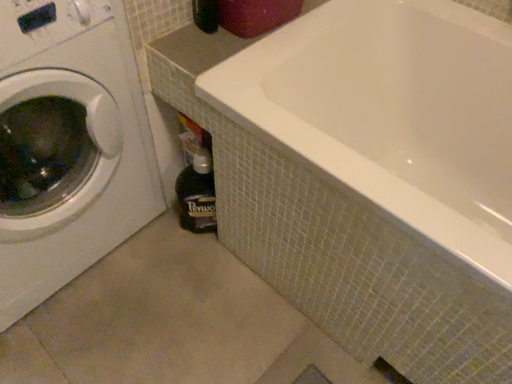
Find the location of a particular element. This screenshot has height=384, width=512. dark brown glass bottle at lower center is located at coordinates (197, 194).

Describe the element at coordinates (392, 114) in the screenshot. I see `white glossy bathtub at center` at that location.

Locate an element on the screen. Image resolution: width=512 pixels, height=384 pixels. dark brown glass bottle at lower center is located at coordinates (197, 194).

From the picture: From their relative heights in the image, would you say white glossy washing machine at left is taller or shorter than white glossy bathtub at center?

Clearly, white glossy washing machine at left is taller compared to white glossy bathtub at center.

Does white glossy washing machine at left have a larger size compared to white glossy bathtub at center?

No.

Is white glossy washing machine at left looking in the opposite direction of white glossy bathtub at center?

white glossy washing machine at left does not have its back to white glossy bathtub at center.

From the image's perspective, is white glossy washing machine at left located above white glossy bathtub at center?

Yes, from the image's perspective, white glossy washing machine at left is above white glossy bathtub at center.

From the image's perspective, does dark brown glass bottle at lower center appear lower than white glossy bathtub at center?

Yes.

Which is behind, dark brown glass bottle at lower center or white glossy bathtub at center?

dark brown glass bottle at lower center is further from the camera.

Looking at this image, which of these two, dark brown glass bottle at lower center or white glossy bathtub at center, is wider?

white glossy bathtub at center is wider.

Considering the relative sizes of white glossy bathtub at center and dark brown glass bottle at lower center in the image provided, is white glossy bathtub at center shorter than dark brown glass bottle at lower center?

No, white glossy bathtub at center is not shorter than dark brown glass bottle at lower center.

From the image's perspective, between white glossy bathtub at center and dark brown glass bottle at lower center, who is located below?

From the image's view, dark brown glass bottle at lower center is below.

From a real-world perspective, which object stands above the other?

From a 3D spatial view, white glossy bathtub at center is above.

Is white glossy bathtub at center inside or outside of dark brown glass bottle at lower center?

white glossy bathtub at center is outside dark brown glass bottle at lower center.

From a real-world perspective, which is physically above, white glossy washing machine at left or dark brown glass bottle at lower center?

white glossy washing machine at left, from a real-world perspective.

Could you tell me if white glossy washing machine at left is facing dark brown glass bottle at lower center?

No, white glossy washing machine at left is not facing towards dark brown glass bottle at lower center.

Considering their positions, is white glossy washing machine at left located in front of or behind dark brown glass bottle at lower center?

white glossy washing machine at left is positioned closer to the viewer than dark brown glass bottle at lower center.

Does white glossy washing machine at left have a lesser width compared to dark brown glass bottle at lower center?

In fact, white glossy washing machine at left might be wider than dark brown glass bottle at lower center.

Can you confirm if white glossy bathtub at center is bigger than white glossy washing machine at left?

Correct, white glossy bathtub at center is larger in size than white glossy washing machine at left.

Is white glossy bathtub at center located outside white glossy washing machine at left?

Yes.

From the image's perspective, does white glossy bathtub at center appear lower than white glossy washing machine at left?

Indeed, from the image's perspective, white glossy bathtub at center is shown beneath white glossy washing machine at left.

How much distance is there between white glossy bathtub at center and white glossy washing machine at left?

21.68 inches.

From a real-world perspective, is dark brown glass bottle at lower center on white glossy washing machine at left?

No, from a real-world perspective, dark brown glass bottle at lower center is not above white glossy washing machine at left.

Does dark brown glass bottle at lower center contain white glossy washing machine at left?

Definitely not — white glossy washing machine at left is not inside dark brown glass bottle at lower center.

How different are the orientations of dark brown glass bottle at lower center and white glossy washing machine at left in degrees?

The angular difference between dark brown glass bottle at lower center and white glossy washing machine at left is 40.1 degrees.

This screenshot has width=512, height=384. Find the location of `bottle below the white glossy washing machine at left (from the image's perspective)`. bottle below the white glossy washing machine at left (from the image's perspective) is located at coordinates (197, 194).

Image resolution: width=512 pixels, height=384 pixels. I want to click on washing machine above the white glossy bathtub at center (from a real-world perspective), so click(68, 145).

In order to click on bathtub that appears above the dark brown glass bottle at lower center (from the image's perspective) in this screenshot , I will do `click(392, 114)`.

Estimate the real-world distances between objects in this image. Which object is closer to white glossy bathtub at center, dark brown glass bottle at lower center or white glossy washing machine at left?

dark brown glass bottle at lower center lies closer to white glossy bathtub at center than the other object.

Which object lies further to the anchor point white glossy washing machine at left, dark brown glass bottle at lower center or white glossy bathtub at center?

white glossy bathtub at center is further to white glossy washing machine at left.

From the image, which object appears to be farther from dark brown glass bottle at lower center, white glossy washing machine at left or white glossy bathtub at center?

white glossy bathtub at center is further to dark brown glass bottle at lower center.

Estimate the real-world distances between objects in this image. Which object is further from white glossy washing machine at left, white glossy bathtub at center or dark brown glass bottle at lower center?

white glossy bathtub at center lies further to white glossy washing machine at left than the other object.

From the image, which object appears to be farther from white glossy bathtub at center, white glossy washing machine at left or dark brown glass bottle at lower center?

Among the two, white glossy washing machine at left is located further to white glossy bathtub at center.

Considering their positions, is white glossy bathtub at center positioned further to dark brown glass bottle at lower center than white glossy washing machine at left?

Among the two, white glossy bathtub at center is located further to dark brown glass bottle at lower center.

This screenshot has width=512, height=384. In order to click on bottle between white glossy washing machine at left and white glossy bathtub at center in this screenshot , I will do `click(197, 194)`.